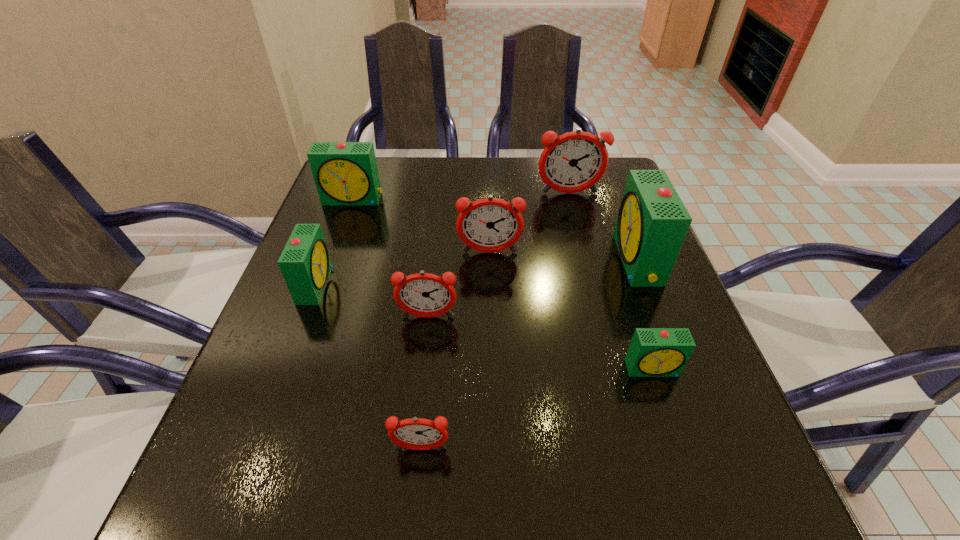
This screenshot has height=540, width=960. In order to click on blank space that satisfies the following two spatial constraints: 1. on the front-facing side of the biggest green alarm clock; 2. on the front-facing side of the nearest reddish-pink alarm clock in this screenshot , I will do `click(709, 449)`.